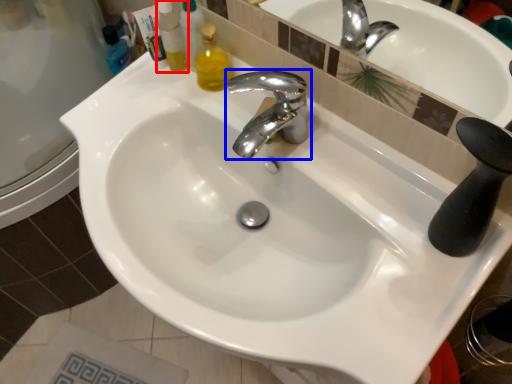
Question: Which object appears closest to the camera in this image, cleaning product (highlighted by a red box) or tap (highlighted by a blue box)?

Choices:
 (A) cleaning product
 (B) tap

Answer: (B)